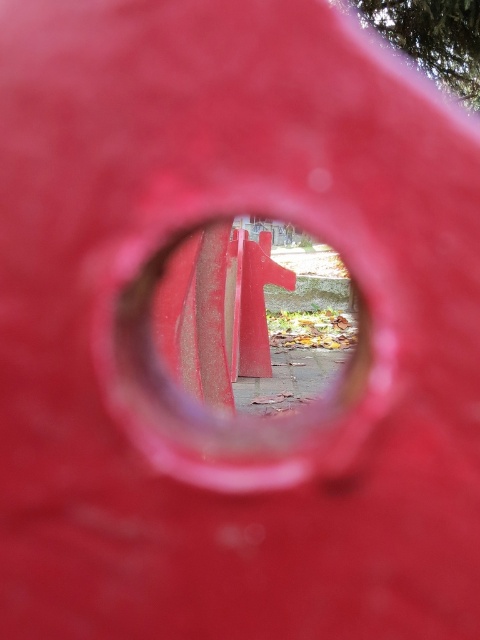
Between smooth matte wood at center and smooth red traffic cone at center, which one is positioned lower?

smooth matte wood at center is lower down.

Is point (173, 369) farther from camera compared to point (241, 257)?

No, (173, 369) is closer to viewer.

Locate an element on the screen. smooth matte wood at center is located at coordinates (220, 342).